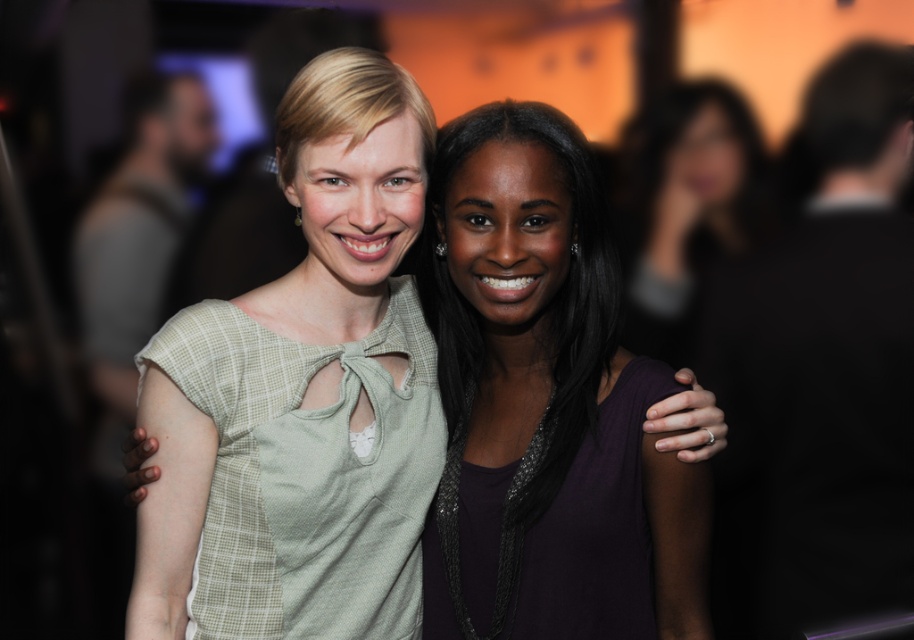
Question: Which of the following is the farthest from the observer?

Choices:
 (A) (380, 148)
 (B) (731, 200)

Answer: (B)

Question: Among these points, which one is nearest to the camera?

Choices:
 (A) (629, 305)
 (B) (639, 432)

Answer: (B)

Question: Can you confirm if purple matte dress at center is smaller than dark purple dress at center?

Choices:
 (A) yes
 (B) no

Answer: (A)

Question: Observing the image, what is the correct spatial positioning of purple matte dress at center in reference to dark purple dress at center?

Choices:
 (A) below
 (B) above

Answer: (A)

Question: Considering the relative positions of purple matte dress at center and light green fabric dress at center in the image provided, where is purple matte dress at center located with respect to light green fabric dress at center?

Choices:
 (A) right
 (B) left

Answer: (A)

Question: Which point appears farthest from the camera in this image?

Choices:
 (A) (675, 106)
 (B) (553, 244)

Answer: (A)